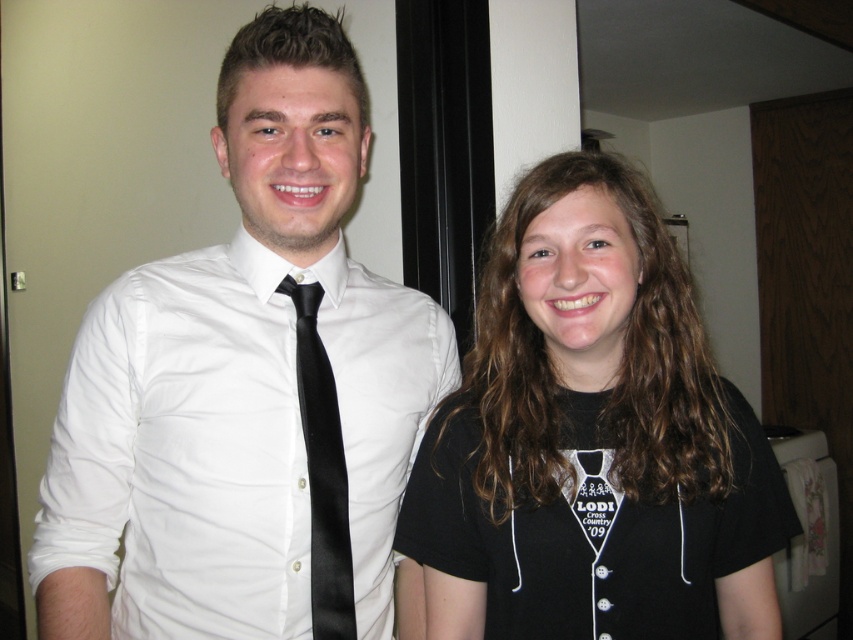
Between white satin shirt at center and black satin tie at center, which one appears on the left side from the viewer's perspective?

Positioned to the left is white satin shirt at center.

Does white satin shirt at center have a greater width compared to black satin tie at center?

Indeed, white satin shirt at center has a greater width compared to black satin tie at center.

Which is behind, point (305, 490) or point (343, 552)?

Positioned behind is point (305, 490).

The height and width of the screenshot is (640, 853). In order to click on white satin shirt at center in this screenshot , I will do `click(233, 440)`.

In the scene shown: Can you confirm if black cotton t-shirt at center is smaller than black satin tie at center?

No, black cotton t-shirt at center is not smaller than black satin tie at center.

Measure the distance between black cotton t-shirt at center and black satin tie at center.

22.74 centimeters

Is point (674, 285) positioned after point (306, 307)?

Yes.

In order to click on black cotton t-shirt at center in this screenshot , I will do `click(589, 435)`.

How distant is black cotton t-shirt at center from white satin shirt at center?

A distance of 19.22 centimeters exists between black cotton t-shirt at center and white satin shirt at center.

Who is more forward, (674, 296) or (62, 531)?

Point (62, 531)

I want to click on black cotton t-shirt at center, so click(589, 435).